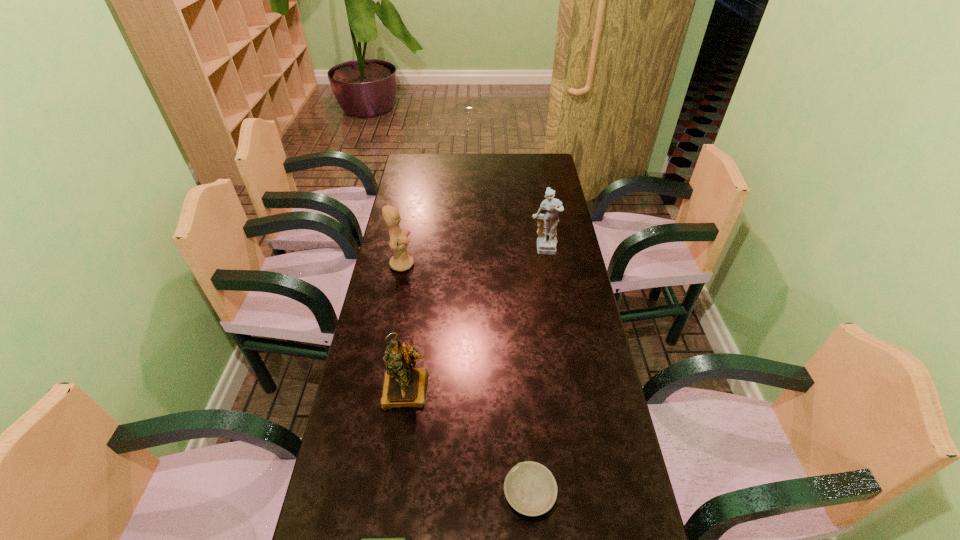
Locate an element on the screen. vacant space at the right edge of the desktop is located at coordinates (535, 232).

Where is `free location at the far left corner`? free location at the far left corner is located at coordinates (428, 164).

The height and width of the screenshot is (540, 960). In order to click on vacant space at the far right corner in this screenshot , I will do `click(544, 164)`.

I want to click on vacant area between the third nearest object and the fourth farthest object, so click(468, 441).

Identify the location of vacant space that's between the fourth farthest object and the nearest figurine. This screenshot has height=540, width=960. (468, 441).

What are the coordinates of `free point between the nearest figurine and the rightmost object` in the screenshot? It's located at (475, 320).

The image size is (960, 540). In order to click on vacant region between the nearest figurine and the rightmost object in this screenshot , I will do `click(475, 320)`.

This screenshot has height=540, width=960. I want to click on object that stands as the fourth closest to the nearest object, so click(547, 223).

Identify the location of the second closest object to the shortest object. (403, 386).

Select which figurine appears as the second closest to the nearest figurine. Please provide its 2D coordinates. Your answer should be formatted as a tuple, i.e. [(x, y)], where the tuple contains the x and y coordinates of a point satisfying the conditions above.

[(547, 223)]